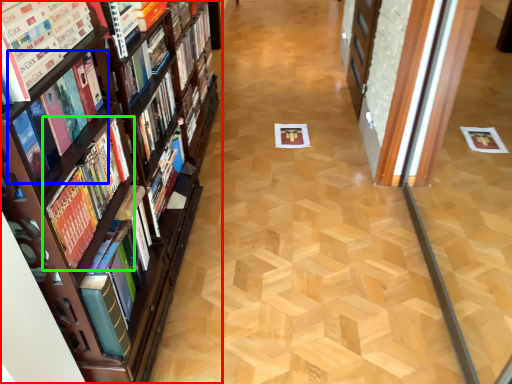
Question: Which object is positioned farthest from book (highlighted by a red box)? Select from book (highlighted by a blue box) and book (highlighted by a green box).

Choices:
 (A) book
 (B) book

Answer: (A)